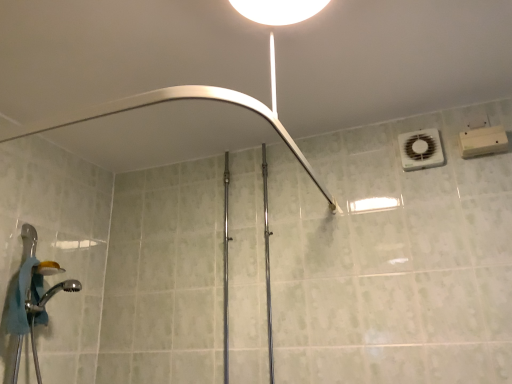
Question: Can you confirm if chrome metallic shower head at lower left, which is counted as the 2th shower, starting from the top, is thinner than white glossy light fixture at upper center?

Choices:
 (A) no
 (B) yes

Answer: (B)

Question: From the image's perspective, does chrome metallic shower head at lower left, the first shower when ordered from bottom to top, appear lower than white glossy light fixture at upper center?

Choices:
 (A) no
 (B) yes

Answer: (B)

Question: Is chrome metallic shower head at lower left, which is counted as the 2th shower, starting from the top, closer to camera compared to white glossy light fixture at upper center?

Choices:
 (A) no
 (B) yes

Answer: (A)

Question: From a real-world perspective, is chrome metallic shower head at lower left, which is counted as the 2th shower, starting from the top, on white glossy light fixture at upper center?

Choices:
 (A) yes
 (B) no

Answer: (B)

Question: Is chrome metallic shower head at lower left, which is counted as the 2th shower, starting from the top, shorter than white glossy light fixture at upper center?

Choices:
 (A) yes
 (B) no

Answer: (B)

Question: Would you say white plastic air conditioner at upper right is to the left or to the right of chrome metallic shower head at lower left, the first shower when ordered from bottom to top, in the picture?

Choices:
 (A) left
 (B) right

Answer: (B)

Question: Do you think white plastic air conditioner at upper right is within chrome metallic shower head at lower left, which is counted as the 2th shower, starting from the top, or outside of it?

Choices:
 (A) outside
 (B) inside

Answer: (A)

Question: In terms of height, does white plastic air conditioner at upper right look taller or shorter compared to chrome metallic shower head at lower left, which is counted as the 2th shower, starting from the top?

Choices:
 (A) short
 (B) tall

Answer: (B)

Question: Is point (402, 148) closer or farther from the camera than point (26, 311)?

Choices:
 (A) farther
 (B) closer

Answer: (A)

Question: Considering the positions of chrome metallic shower head at lower left, which is counted as the 2th shower, starting from the top, and white plastic air conditioner at upper right in the image, is chrome metallic shower head at lower left, which is counted as the 2th shower, starting from the top, bigger or smaller than white plastic air conditioner at upper right?

Choices:
 (A) small
 (B) big

Answer: (B)

Question: Relative to white plastic air conditioner at upper right, is chrome metallic shower head at lower left, which is counted as the 2th shower, starting from the top, in front or behind?

Choices:
 (A) front
 (B) behind

Answer: (A)

Question: Would you say chrome metallic shower head at lower left, which is counted as the 2th shower, starting from the top, is to the left or to the right of white plastic air conditioner at upper right in the picture?

Choices:
 (A) right
 (B) left

Answer: (B)

Question: Is point (39, 309) closer or farther from the camera than point (422, 135)?

Choices:
 (A) farther
 (B) closer

Answer: (B)

Question: Is brushed metal shower at upper center, the second shower when ordered from bottom to top, inside or outside of white plastic air conditioner at upper right?

Choices:
 (A) inside
 (B) outside

Answer: (B)

Question: Is brushed metal shower at upper center, the 1th shower in the top-to-bottom sequence, wider or thinner than white plastic air conditioner at upper right?

Choices:
 (A) wide
 (B) thin

Answer: (A)